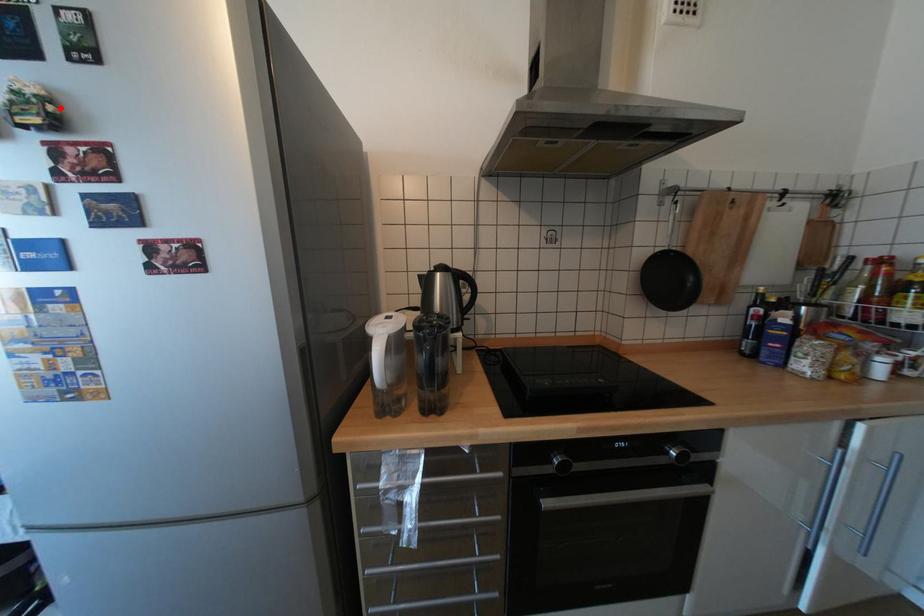
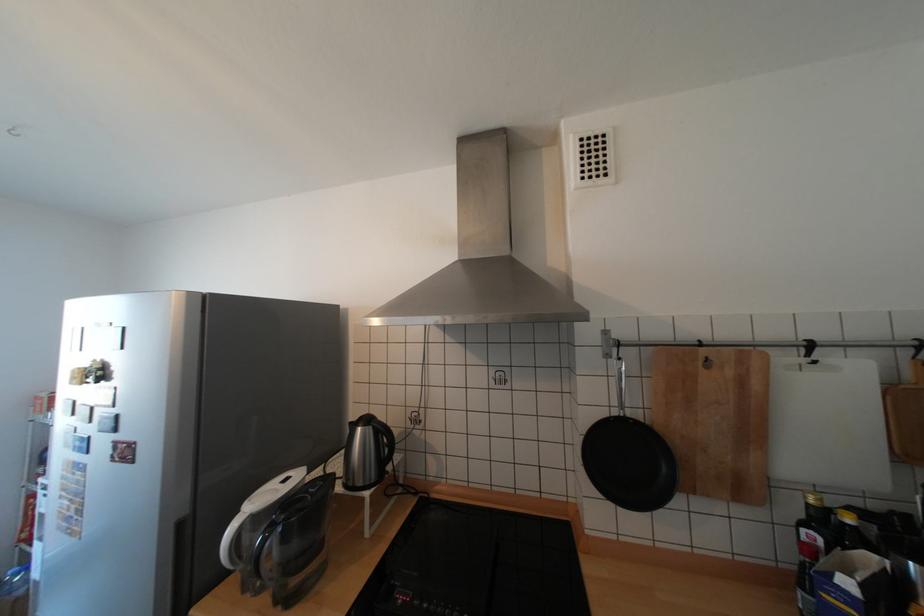
Find the pixel in the second image that matches the highlighted location in the first image.

(108, 373)